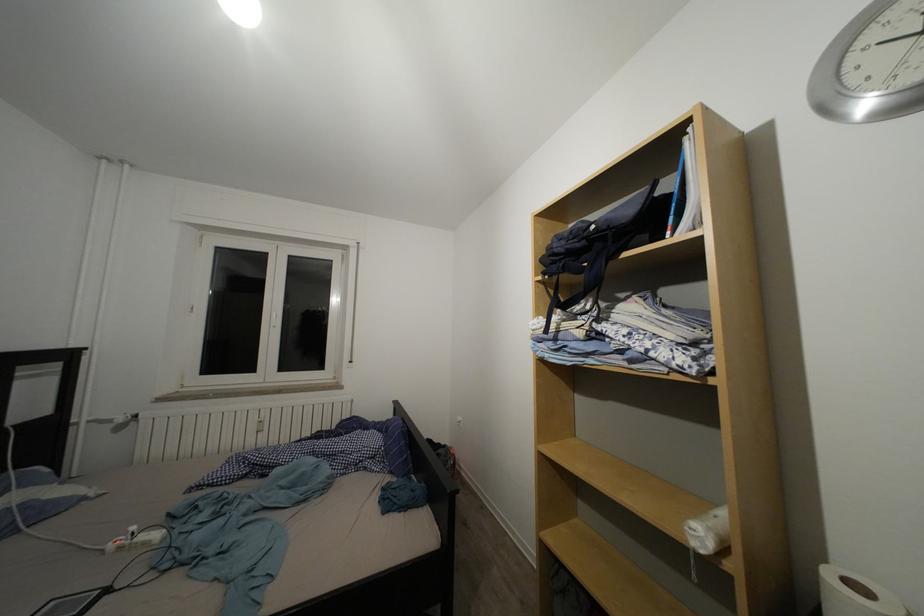
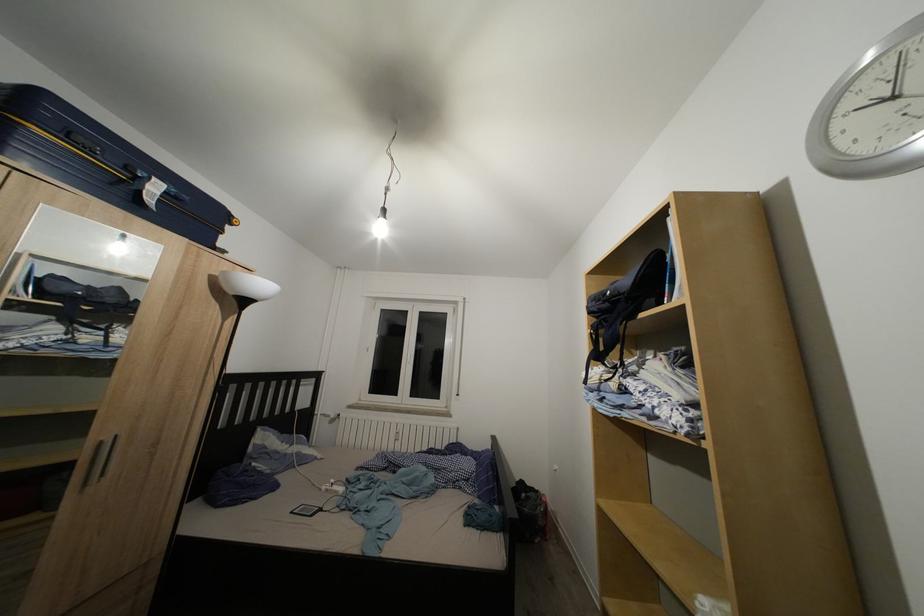
Where in the second image is the point corresponding to (568,257) from the first image?

(602, 315)